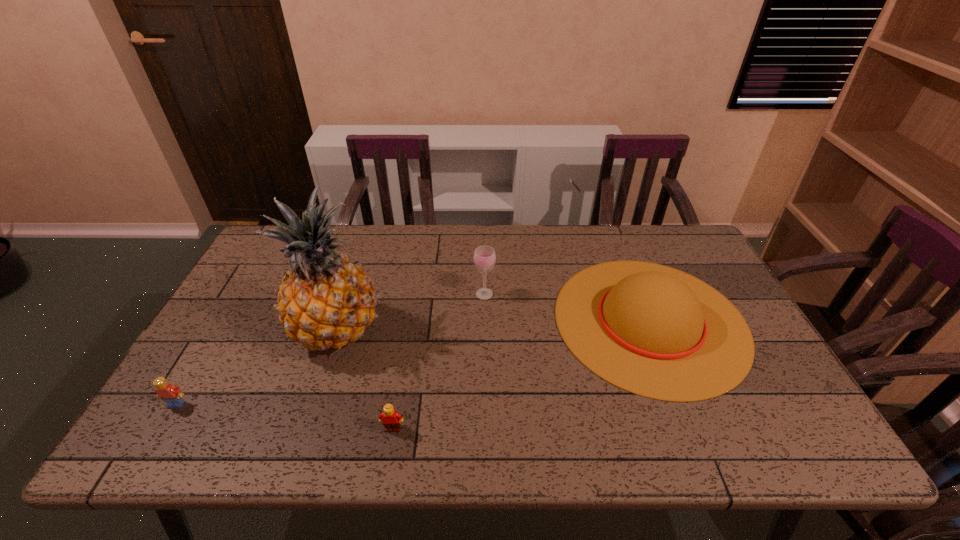
The image size is (960, 540). Find the location of `pineapple`. pineapple is located at coordinates (325, 301).

What are the coordinates of `the second object from left to right` in the screenshot? It's located at (325, 301).

The height and width of the screenshot is (540, 960). Find the location of `the fourth object from left to right`. the fourth object from left to right is located at coordinates (484, 257).

The width and height of the screenshot is (960, 540). What are the coordinates of `the rightmost object` in the screenshot? It's located at (652, 330).

Identify the location of the farther Lego. This screenshot has height=540, width=960. (172, 395).

Locate an element on the screen. The image size is (960, 540). the leftmost object is located at coordinates (172, 395).

This screenshot has height=540, width=960. Find the location of `the right Lego`. the right Lego is located at coordinates (391, 419).

Where is `the nearer Lego`? The image size is (960, 540). the nearer Lego is located at coordinates (391, 419).

Identify the location of free space located 0.170m on the front of the pineapple. (306, 430).

Locate an element on the screen. vacant space located on the left of the wineglass is located at coordinates (x=417, y=294).